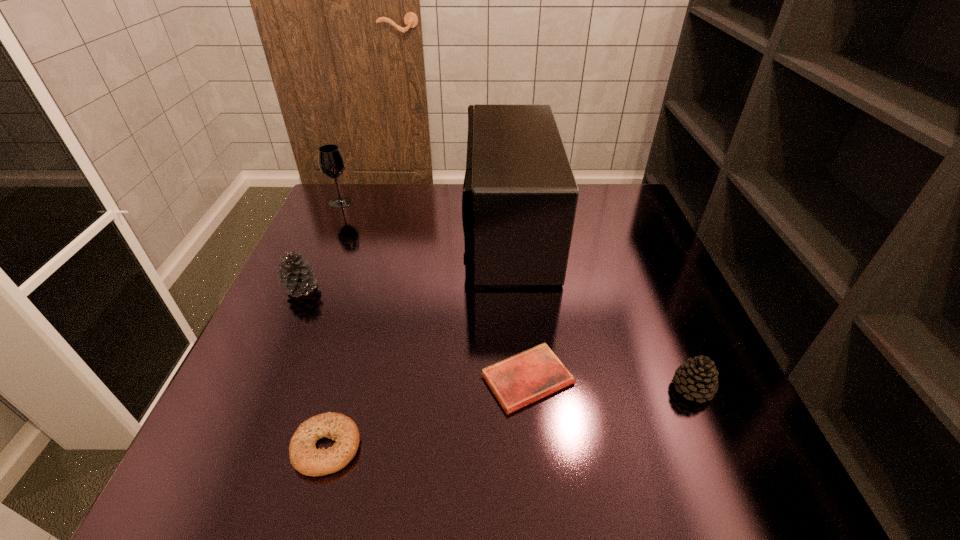
In order to click on microwave_oven in this screenshot , I will do `click(519, 200)`.

I want to click on wineglass, so click(331, 162).

You are a GUI agent. You are given a task and a screenshot of the screen. Output one action in this format:
    pyautogui.click(x=<x>, y=<y>)
    Task: Click on the left pinecone
    This screenshot has width=960, height=540.
    Given the screenshot: What is the action you would take?
    pyautogui.click(x=296, y=277)

At what (x,y) coordinates should I click in order to perform the action: click on the third tallest object. Please return your answer as a coordinate pair (x, y). This screenshot has width=960, height=540. Looking at the image, I should click on (296, 277).

At what (x,y) coordinates should I click in order to perform the action: click on the third shortest object. Please return your answer as a coordinate pair (x, y). Image resolution: width=960 pixels, height=540 pixels. Looking at the image, I should click on (697, 378).

Where is `the nearer pinecone`? Image resolution: width=960 pixels, height=540 pixels. the nearer pinecone is located at coordinates (697, 378).

The width and height of the screenshot is (960, 540). What are the coordinates of `the fifth tallest object` in the screenshot? It's located at (304, 456).

The image size is (960, 540). In order to click on the nearest object in this screenshot , I will do `click(304, 456)`.

This screenshot has width=960, height=540. What are the coordinates of `diary` in the screenshot? It's located at point(531,375).

The height and width of the screenshot is (540, 960). In order to click on free space located 0.250m on the front-facing side of the tallest object in this screenshot , I will do coord(372,230).